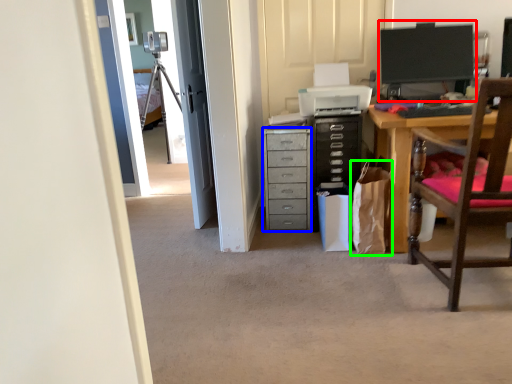
Question: Based on their relative distances, which object is farther from computer monitor (highlighted by a red box)? Choose from chest of drawers (highlighted by a blue box) and shopping bag (highlighted by a green box).

Choices:
 (A) chest of drawers
 (B) shopping bag

Answer: (A)